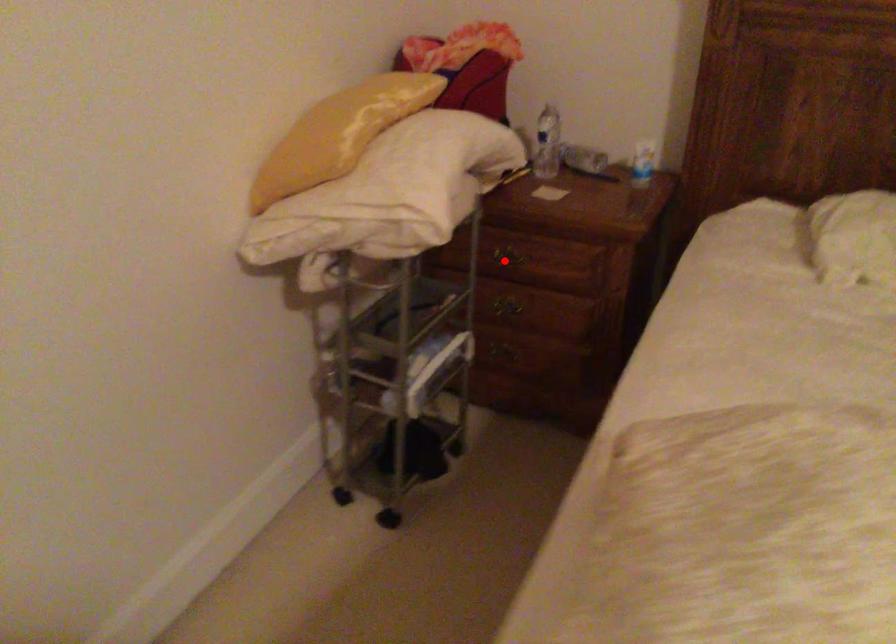
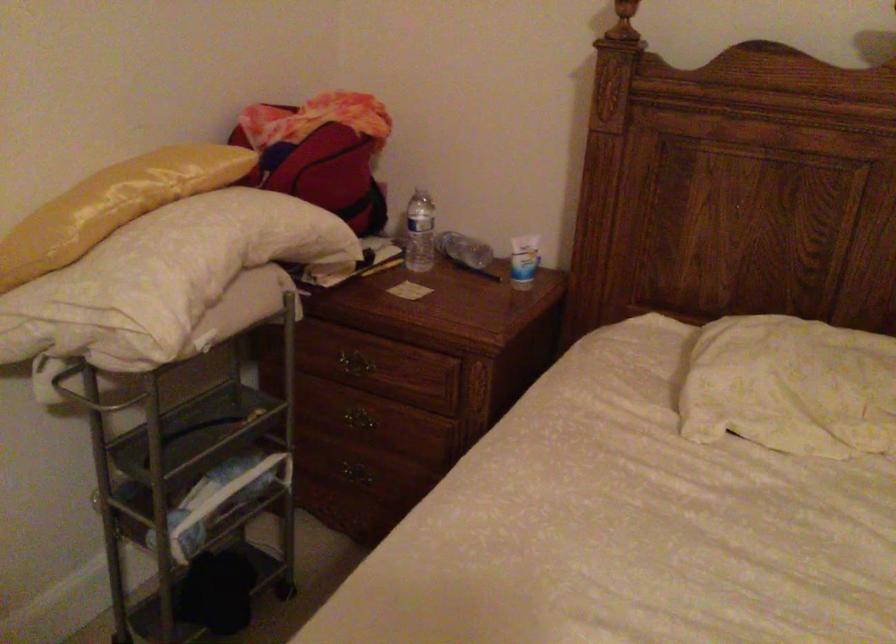
Locate, in the second image, the point that corresponds to the highlighted location in the first image.

(350, 365)